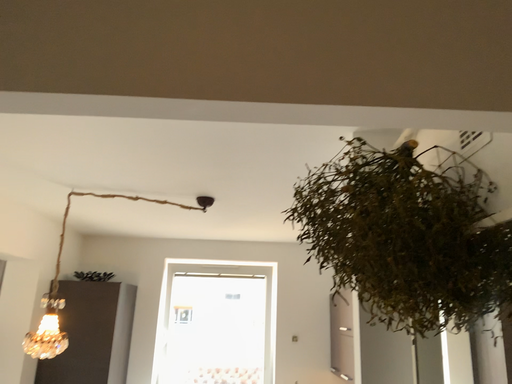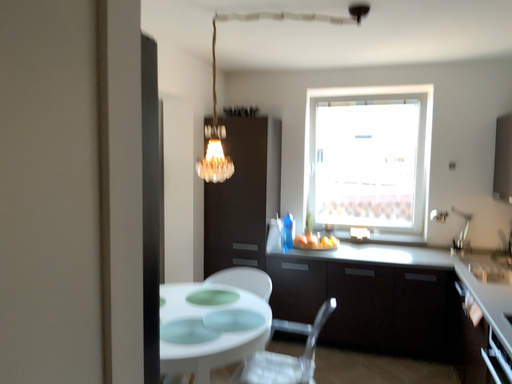
Question: How did the camera likely rotate when shooting the video?

Choices:
 (A) rotated right
 (B) rotated left

Answer: (B)